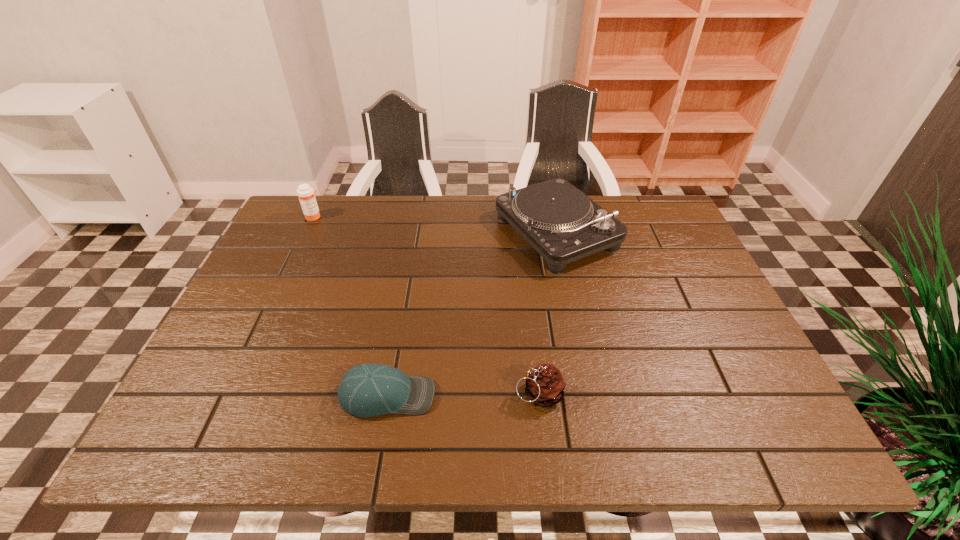
Where is `empty location between the second object from left to right and the record player`? Image resolution: width=960 pixels, height=540 pixels. empty location between the second object from left to right and the record player is located at coordinates (472, 314).

The image size is (960, 540). I want to click on free area in between the pinecone and the medicine, so click(x=426, y=305).

At what (x,y) coordinates should I click in order to perform the action: click on vacant space in between the third tallest object and the baseball cap. Please return your answer as a coordinate pair (x, y). The height and width of the screenshot is (540, 960). Looking at the image, I should click on point(463,395).

Locate an element on the screen. This screenshot has width=960, height=540. the third closest object relative to the medicine is located at coordinates (545, 385).

Select which object appears as the second closest to the third object from right to left. Please provide its 2D coordinates. Your answer should be formatted as a tuple, i.e. [(x, y)], where the tuple contains the x and y coordinates of a point satisfying the conditions above.

[(559, 221)]

Find the location of a particular element. vacant space that satisfies the following two spatial constraints: 1. on the back side of the record player; 2. on the left side of the second object from left to right is located at coordinates (416, 232).

This screenshot has height=540, width=960. Identify the location of free location that satisfies the following two spatial constraints: 1. on the front side of the record player; 2. with a leaf charm attached to the pinecone. (589, 394).

The image size is (960, 540). I want to click on free location that satisfies the following two spatial constraints: 1. on the front side of the leftmost object; 2. on the right side of the record player, so [306, 232].

The image size is (960, 540). I want to click on free point that satisfies the following two spatial constraints: 1. on the front side of the record player; 2. with a leaf charm attached to the second shortest object, so (589, 394).

Where is `vacant space that satisfies the following two spatial constraints: 1. on the front side of the record player; 2. with a leaf charm attached to the pinecone`? This screenshot has height=540, width=960. vacant space that satisfies the following two spatial constraints: 1. on the front side of the record player; 2. with a leaf charm attached to the pinecone is located at coordinates (589, 394).